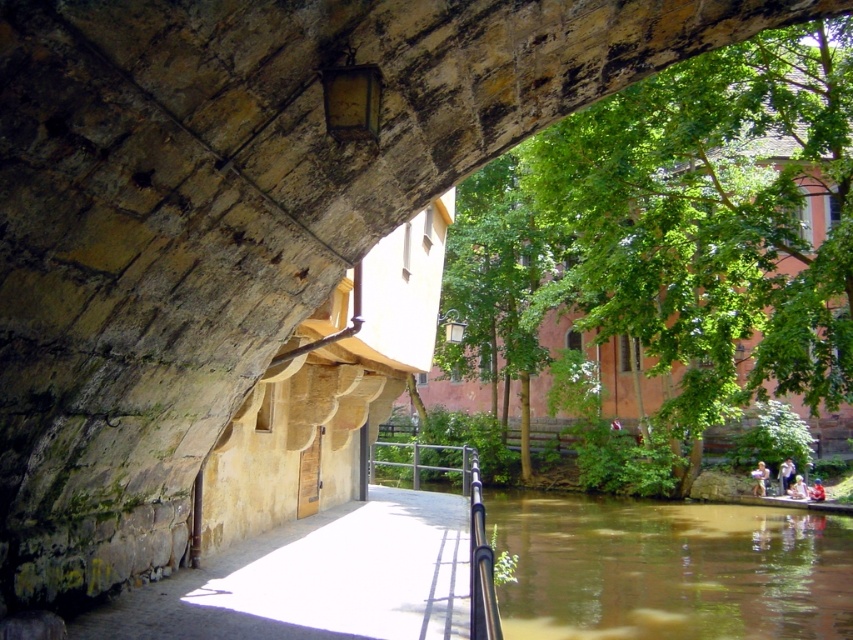
Question: Among these objects, which one is farthest from the camera?

Choices:
 (A) polished metal railing at center
 (B) brown murky water at lower right

Answer: (B)

Question: Can you confirm if green leafy tree at center is thinner than polished metal railing at center?

Choices:
 (A) yes
 (B) no

Answer: (B)

Question: Is green leafy tree at center smaller than polished metal railing at lower center?

Choices:
 (A) no
 (B) yes

Answer: (A)

Question: Estimate the real-world distances between objects in this image. Which object is farther from the polished metal railing at center?

Choices:
 (A) brown murky water at lower right
 (B) green leafy tree at center
 (C) polished metal railing at lower center

Answer: (B)

Question: Based on their relative distances, which object is nearer to the brown murky water at lower right?

Choices:
 (A) green leafy tree at center
 (B) polished metal railing at lower center
 (C) polished metal railing at center

Answer: (B)

Question: Does brown murky water at lower right lie in front of polished metal railing at center?

Choices:
 (A) no
 (B) yes

Answer: (A)